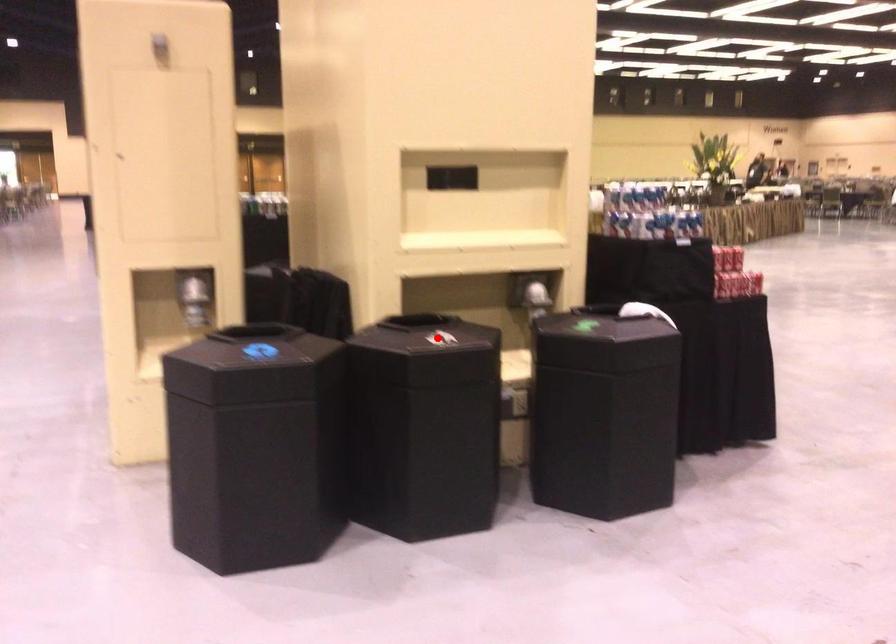
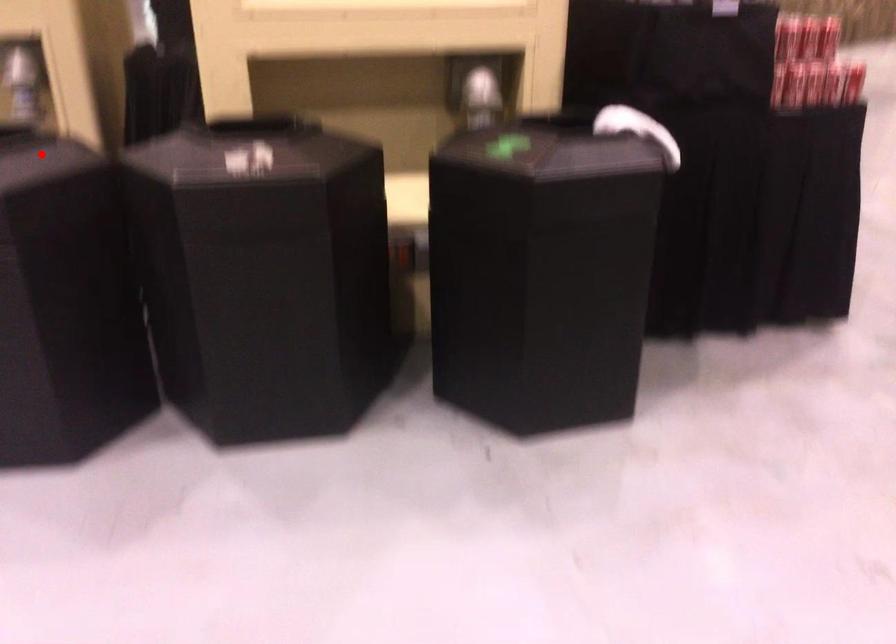
I am providing you with two images of the same scene from different viewpoints. A red point is marked on the first image and another point is marked on the second image. Is the marked point in image1 the same physical position as the marked point in image2?

No